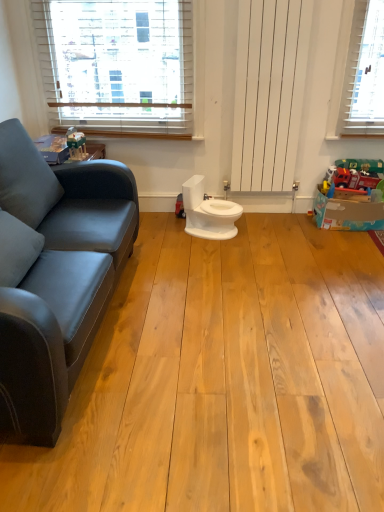
Question: Is matte red fire truck at right, acting as the second toy starting from the left, located within white glossy toilet at center?

Choices:
 (A) yes
 (B) no

Answer: (B)

Question: Is the depth of white glossy toilet at center less than that of matte red fire truck at right, arranged as the 2th toy when viewed from the front?

Choices:
 (A) no
 (B) yes

Answer: (B)

Question: Considering the relative positions of white glossy toilet at center and matte red fire truck at right, arranged as the 2th toy when viewed from the front, in the image provided, is white glossy toilet at center behind matte red fire truck at right, arranged as the 2th toy when viewed from the front,?

Choices:
 (A) yes
 (B) no

Answer: (B)

Question: From a real-world perspective, does white glossy toilet at center sit lower than matte red fire truck at right, arranged as the 2th toy when viewed from the front?

Choices:
 (A) no
 (B) yes

Answer: (B)

Question: Is white glossy toilet at center positioned beyond the bounds of matte red fire truck at right, placed as the first toy when sorted from back to front?

Choices:
 (A) no
 (B) yes

Answer: (B)

Question: From the image's perspective, does white glossy toilet at center appear lower than matte red fire truck at right, arranged as the 1th toy when viewed from the right?

Choices:
 (A) yes
 (B) no

Answer: (A)

Question: Is white wooden blinds at upper left wider than matte red fire truck at right, acting as the second toy starting from the left?

Choices:
 (A) yes
 (B) no

Answer: (B)

Question: Is white wooden blinds at upper left in contact with matte red fire truck at right, arranged as the 2th toy when viewed from the front?

Choices:
 (A) yes
 (B) no

Answer: (B)

Question: Can we say white wooden blinds at upper left lies outside matte red fire truck at right, arranged as the 2th toy when viewed from the front?

Choices:
 (A) yes
 (B) no

Answer: (A)

Question: Is there a large distance between white wooden blinds at upper left and matte red fire truck at right, acting as the second toy starting from the left?

Choices:
 (A) yes
 (B) no

Answer: (A)

Question: From the image's perspective, is white wooden blinds at upper left beneath matte red fire truck at right, arranged as the 2th toy when viewed from the front?

Choices:
 (A) no
 (B) yes

Answer: (A)

Question: Can you confirm if white wooden blinds at upper left is positioned to the left of matte red fire truck at right, arranged as the 1th toy when viewed from the right?

Choices:
 (A) no
 (B) yes

Answer: (B)

Question: Considering the relative positions of matte plastic toy at upper left, which is counted as the 2th toy, starting from the back, and white wooden blinds at upper left in the image provided, is matte plastic toy at upper left, which is counted as the 2th toy, starting from the back, to the left of white wooden blinds at upper left from the viewer's perspective?

Choices:
 (A) no
 (B) yes

Answer: (B)